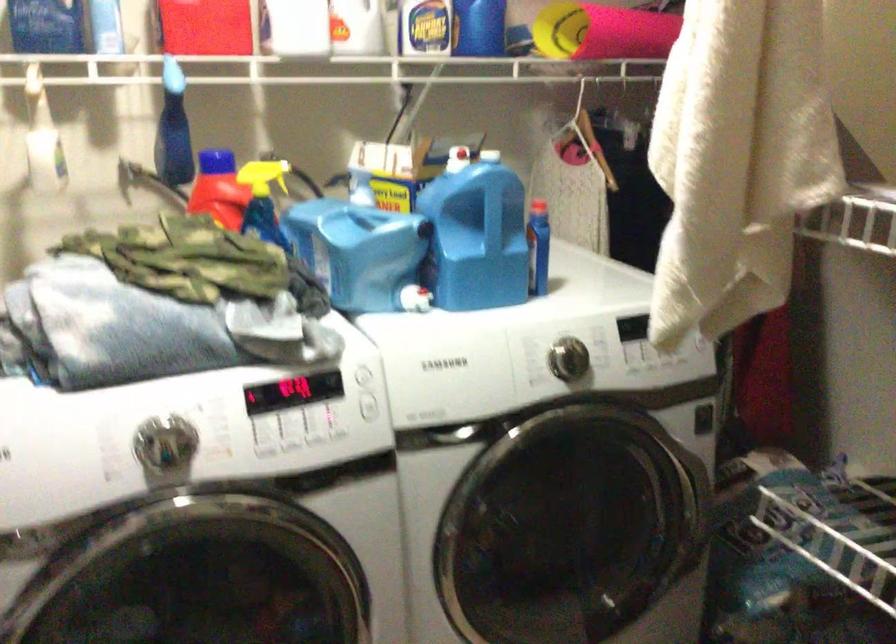
The width and height of the screenshot is (896, 644). What do you see at coordinates (174, 129) in the screenshot?
I see `a blue spray bottle trigger` at bounding box center [174, 129].